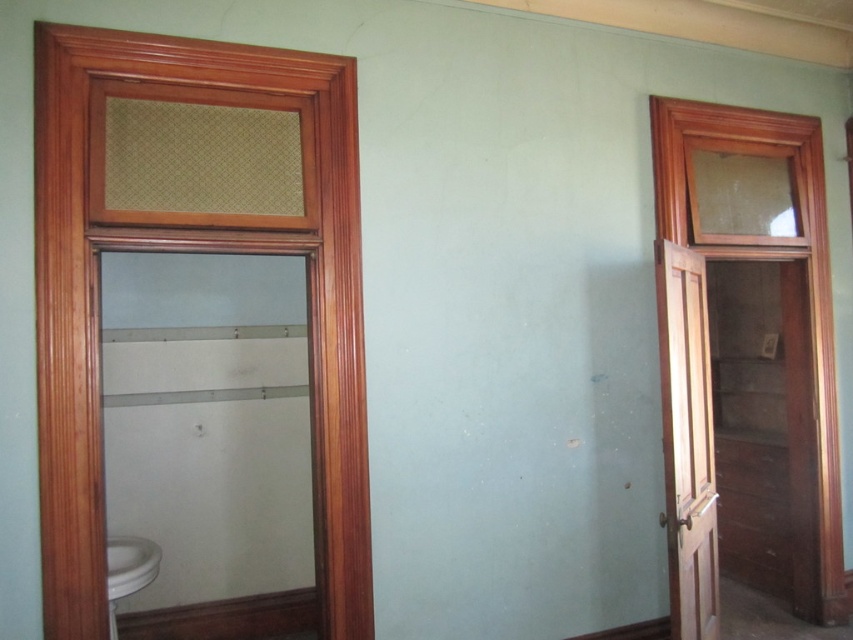
You are standing in the room and want to go to the bathroom. Which door should you choose between the wooden textured window at left and the light brown wooden screen door at right?

The wooden textured window at left is the door leading to the bathroom.

You are standing in the room and want to wash your hands. Which object should you approach first, the light brown wooden screen door at right or the white glossy sink at lower left?

You should approach the white glossy sink at lower left first because it is closer to you than the light brown wooden screen door at right, which is further away.

You are moving a large painting that is 1.2 meters wide. You need to pass through either the wooden textured window at left or the light brown wooden screen door at right. Which door should you choose to ensure the painting fits through?

The wooden textured window at left is larger in size than the light brown wooden screen door at right, so you should choose the wooden textured window at left to ensure the painting fits through.